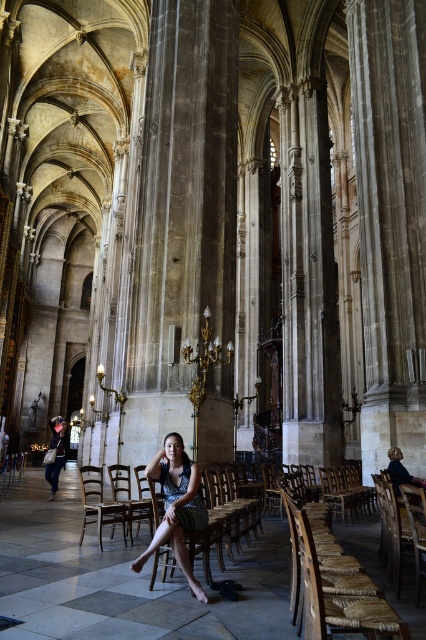
Between wooden chair at center and matte black dress at lower left, which one has more height?

Standing taller between the two is matte black dress at lower left.

Is wooden chair at center closer to the viewer compared to matte black dress at lower left?

That is True.

Find the location of a particular element. wooden chair at center is located at coordinates (129, 499).

Is point (120, 508) in front of point (66, 445)?

That is True.

Is wooden polished chair at center taller than matte black dress at lower left?

No, wooden polished chair at center is not taller than matte black dress at lower left.

What are the coordinates of `wooden polished chair at center` in the screenshot? It's located at (97, 502).

The image size is (426, 640). Identify the location of wooden polished chair at center. (97, 502).

Locate an element on the screen. This screenshot has height=640, width=426. dark blue dotted dress at center is located at coordinates (176, 506).

Does dark blue dotted dress at center have a smaller size compared to wooden chair at center?

Yes.

Which is in front, point (161, 545) or point (118, 484)?

Point (161, 545)

Locate an element on the screen. The height and width of the screenshot is (640, 426). dark blue dotted dress at center is located at coordinates (176, 506).